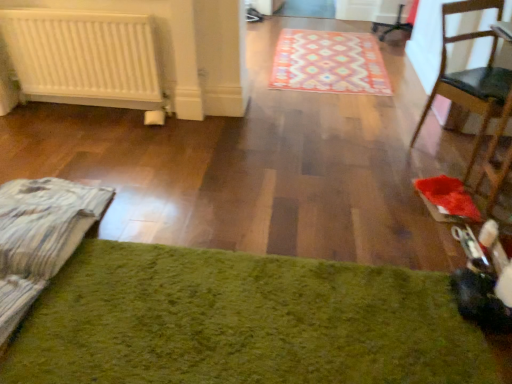
This screenshot has width=512, height=384. Identify the location of vacant space that is to the left of wooden chair at right. (386, 151).